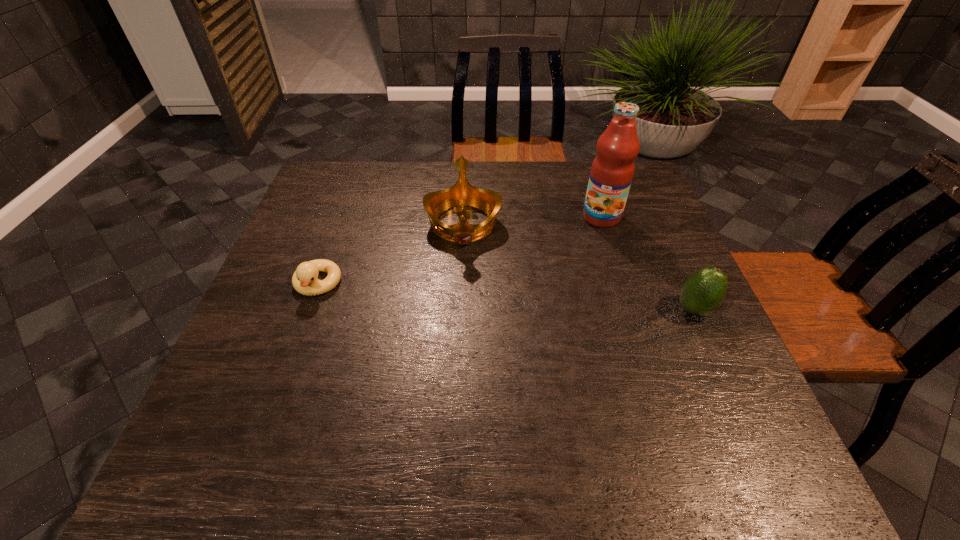
Find the location of a particular element. This screenshot has width=960, height=540. duckling is located at coordinates (304, 280).

Where is `the shortest object`? The width and height of the screenshot is (960, 540). the shortest object is located at coordinates (304, 280).

Image resolution: width=960 pixels, height=540 pixels. Find the location of `avocado`. avocado is located at coordinates (702, 293).

Where is `the tallest object`? The width and height of the screenshot is (960, 540). the tallest object is located at coordinates (612, 170).

The width and height of the screenshot is (960, 540). Identify the location of the second object from right to left. (612, 170).

Find the location of a particular element. The image size is (960, 540). tiara is located at coordinates (462, 194).

The image size is (960, 540). I want to click on vacant region located 0.230m at the beak of the duckling, so click(x=277, y=394).

Locate an element on the screen. vacant area situated on the left of the avocado is located at coordinates (515, 310).

Find the location of `vacant space located 0.220m on the front label of the tallest object`. vacant space located 0.220m on the front label of the tallest object is located at coordinates (564, 277).

Locate an element on the screen. This screenshot has width=960, height=540. vacant point located 0.370m on the front label of the tallest object is located at coordinates (540, 319).